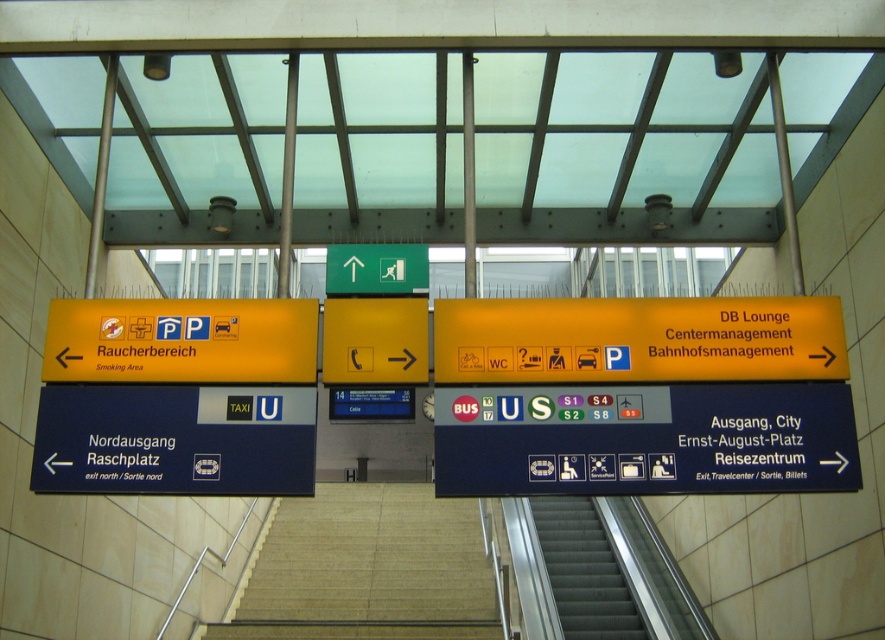
Is yellow matte phone at center bigger than green matte sign at upper center?

Correct, yellow matte phone at center is larger in size than green matte sign at upper center.

Does point (386, 378) come closer to viewer compared to point (412, 292)?

Yes, it is.

Locate an element on the screen. Image resolution: width=885 pixels, height=640 pixels. yellow matte phone at center is located at coordinates (375, 340).

Can you confirm if metallic gray stairs at center is bigger than green matte sign at upper center?

Yes.

Describe the element at coordinates (583, 572) in the screenshot. I see `metallic gray stairs at center` at that location.

Locate an element on the screen. metallic gray stairs at center is located at coordinates (583, 572).

From the picture: Can you confirm if yellow matte sign at right is taller than metallic gray stairs at center?

Incorrect, yellow matte sign at right's height is not larger of metallic gray stairs at center's.

Who is shorter, yellow matte sign at right or metallic gray stairs at center?

With less height is yellow matte sign at right.

Is point (708, 330) more distant than point (572, 579)?

No, (708, 330) is closer to viewer.

Where is `yellow matte sign at right`? The height and width of the screenshot is (640, 885). yellow matte sign at right is located at coordinates (637, 339).